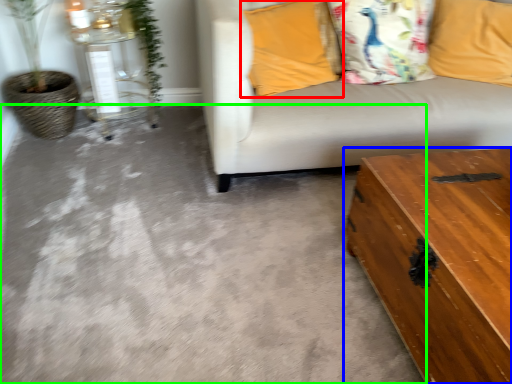
Question: Which object is the closest to the pillow (highlighted by a red box)? Choose among these: table (highlighted by a blue box) or concrete (highlighted by a green box).

Choices:
 (A) table
 (B) concrete

Answer: (B)